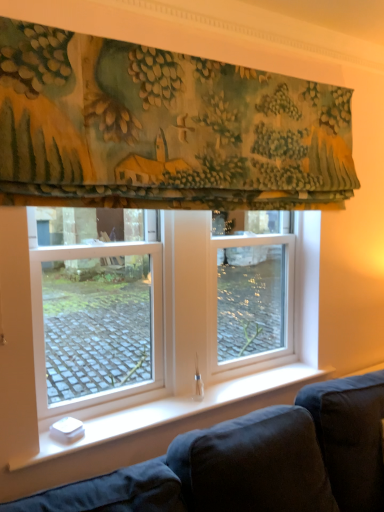
The image size is (384, 512). I want to click on free space above dark blue fabric couch at lower left (from a real-world perspective), so pyautogui.click(x=188, y=400).